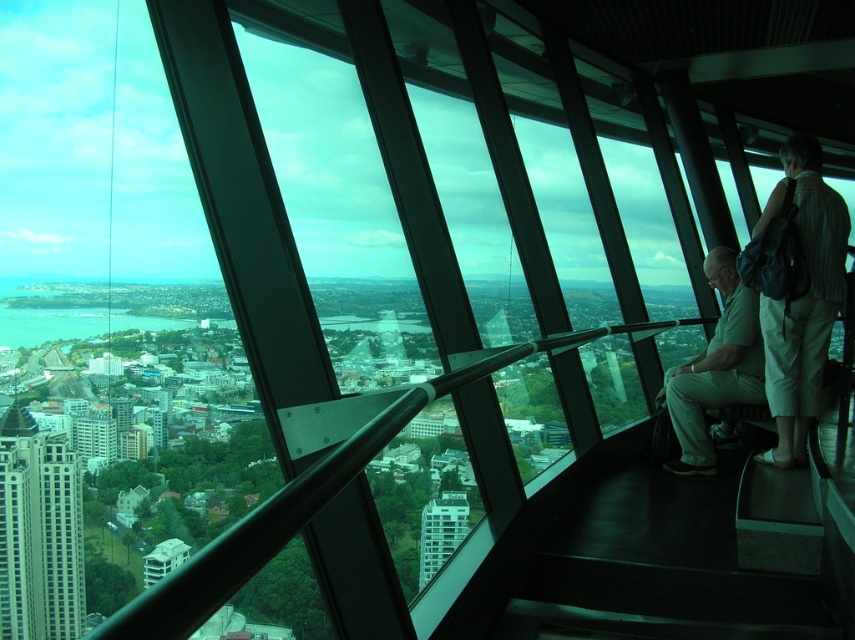
You are standing inside the modern glass structure and want to take a photo of the cityscape. You notice two people wearing a striped fabric shirt at right and light beige pants at center. The camera you have can focus on objects up to 25 meters away. Will both subjects be in focus?

Result: The distance between the striped fabric shirt at right and light beige pants at center is 22.30 meters. Since the camera can focus up to 25 meters, both subjects will be in focus as the distance is within the camera range.

From the picture: You are standing inside the modern glass structure and want to take a photo of both the light beige pants at center and the white glass building at center. Since you have a wide angle lens, can you fit both objects in the frame without moving your position?

The light beige pants at center is wider than the white glass building at center, so you can fit both objects in the frame as long as the lens can accommodate the width of the wider object.